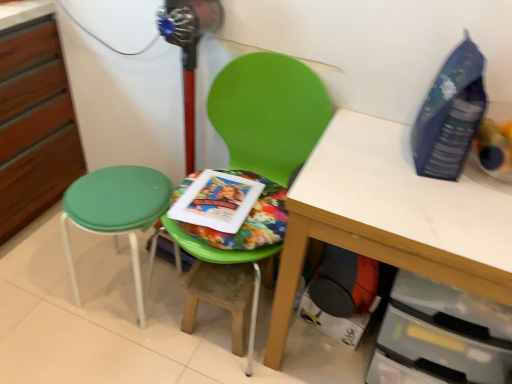
You are a GUI agent. You are given a task and a screenshot of the screen. Output one action in this format:
    pyautogui.click(x=<x>, y=<y>)
    Task: Click on the free space above green fabric stool at left (from a real-world perspective)
    The image size is (512, 384).
    Given the screenshot: What is the action you would take?
    pyautogui.click(x=115, y=198)